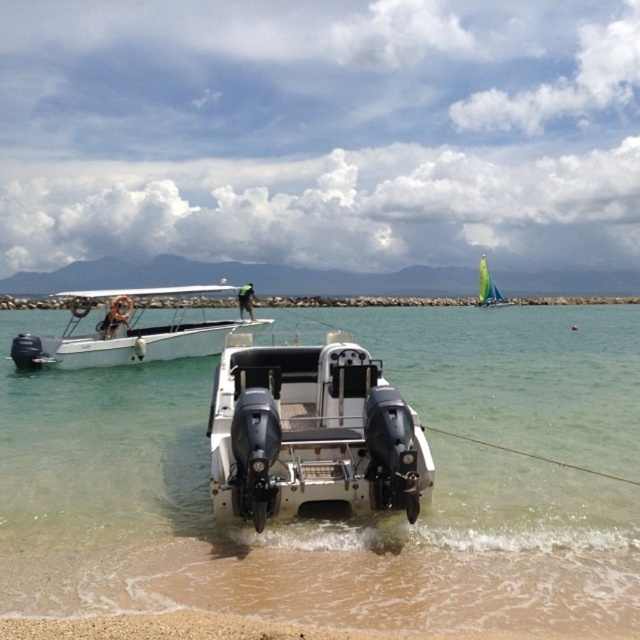
Can you confirm if white matte boat at upper left is positioned to the right of yellow sailboat at upper right?

No, white matte boat at upper left is not to the right of yellow sailboat at upper right.

Is white matte boat at upper left smaller than yellow sailboat at upper right?

Yes.

What do you see at coordinates (125, 332) in the screenshot?
I see `white matte boat at upper left` at bounding box center [125, 332].

The height and width of the screenshot is (640, 640). Find the location of `white matte boat at upper left`. white matte boat at upper left is located at coordinates (125, 332).

Does clear water at boat front have a greater width compared to white matte boat at center?

Indeed, clear water at boat front has a greater width compared to white matte boat at center.

Is point (289, 582) closer to viewer compared to point (298, 368)?

Yes, point (289, 582) is in front of point (298, 368).

Which is behind, point (77, 573) or point (284, 376)?

Point (284, 376)

At what (x,y) coordinates should I click in order to perform the action: click on clear water at boat front. Please return your answer as a coordinate pair (x, y). This screenshot has height=640, width=640. Looking at the image, I should click on (355, 518).

Is the position of clear water at boat front less distant than that of yellow sailboat at upper right?

Yes.

Between clear water at boat front and yellow sailboat at upper right, which one is positioned higher?

Positioned higher is yellow sailboat at upper right.

Is point (289, 600) positioned in front of point (483, 296)?

Yes, it is in front of point (483, 296).

Where is `clear water at boat front`? clear water at boat front is located at coordinates (355, 518).